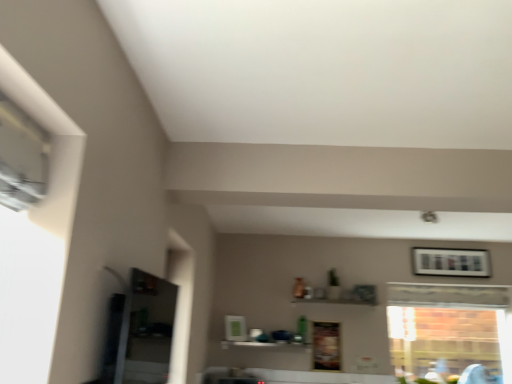
Question: Does wooden framed picture at upper right come in front of white glossy shelf at center?

Choices:
 (A) yes
 (B) no

Answer: (B)

Question: Is white glossy shelf at center at the back of wooden framed picture at upper right?

Choices:
 (A) no
 (B) yes

Answer: (A)

Question: Considering the relative sizes of wooden framed picture at upper right and white glossy shelf at center in the image provided, is wooden framed picture at upper right bigger than white glossy shelf at center?

Choices:
 (A) yes
 (B) no

Answer: (A)

Question: From a real-world perspective, is wooden framed picture at upper right below white glossy shelf at center?

Choices:
 (A) no
 (B) yes

Answer: (A)

Question: From the image's perspective, is wooden framed picture at upper right over white glossy shelf at center?

Choices:
 (A) no
 (B) yes

Answer: (B)

Question: Does wooden framed picture at upper right have a lesser width compared to white glossy shelf at center?

Choices:
 (A) no
 (B) yes

Answer: (B)

Question: Is white glossy shelf at center to the right of wooden framed picture at upper right from the viewer's perspective?

Choices:
 (A) yes
 (B) no

Answer: (B)

Question: Is white glossy shelf at center positioned far away from wooden framed picture at upper right?

Choices:
 (A) yes
 (B) no

Answer: (A)

Question: Considering the relative sizes of white glossy shelf at center and wooden framed picture at upper right in the image provided, is white glossy shelf at center smaller than wooden framed picture at upper right?

Choices:
 (A) yes
 (B) no

Answer: (A)

Question: Is white glossy shelf at center at the left side of wooden framed picture at upper right?

Choices:
 (A) yes
 (B) no

Answer: (A)

Question: Is white glossy shelf at center oriented towards wooden framed picture at upper right?

Choices:
 (A) yes
 (B) no

Answer: (B)

Question: From the image's perspective, is white glossy shelf at center located beneath wooden framed picture at upper right?

Choices:
 (A) no
 (B) yes

Answer: (B)

Question: Is wooden framed picture at upper right not close to clear glass window at right?

Choices:
 (A) no
 (B) yes

Answer: (B)